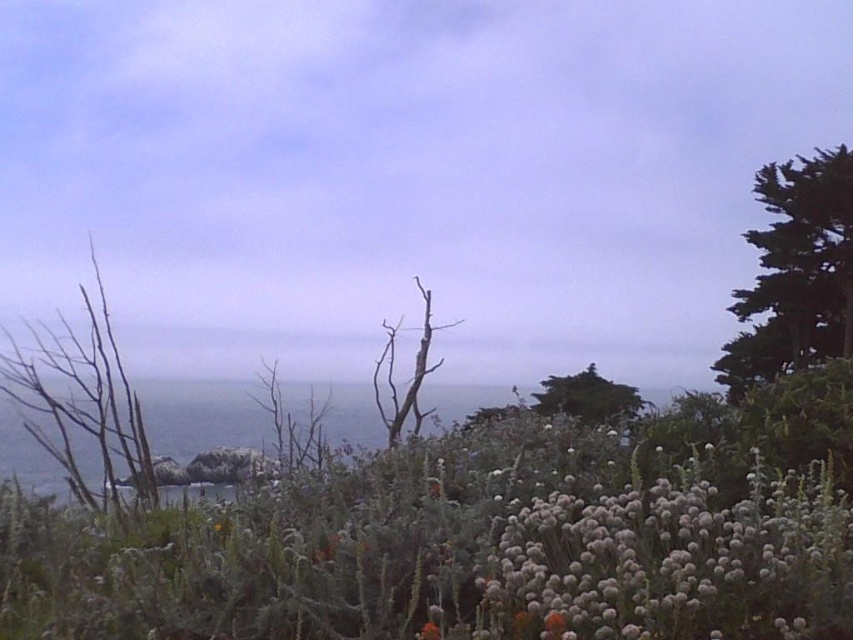
Question: Can you confirm if green leafy tree at upper right is positioned to the right of bare wood tree at center?

Choices:
 (A) no
 (B) yes

Answer: (B)

Question: Which object is the farthest from the green leafy tree at center?

Choices:
 (A) fluffy white flowers at center
 (B) green leafy tree at upper right

Answer: (A)

Question: Which object appears closest to the camera in this image?

Choices:
 (A) bare wood tree at center
 (B) green leafy tree at center
 (C) fluffy white flowers at center
 (D) green leafy tree at upper right

Answer: (C)

Question: Which point is farther from the camera taking this photo?

Choices:
 (A) 770,250
 (B) 585,387

Answer: (A)

Question: Can you confirm if green leafy tree at upper right is bigger than bare wood tree at center?

Choices:
 (A) no
 (B) yes

Answer: (B)

Question: Does fluffy white flowers at center appear on the left side of green leafy tree at center?

Choices:
 (A) yes
 (B) no

Answer: (A)